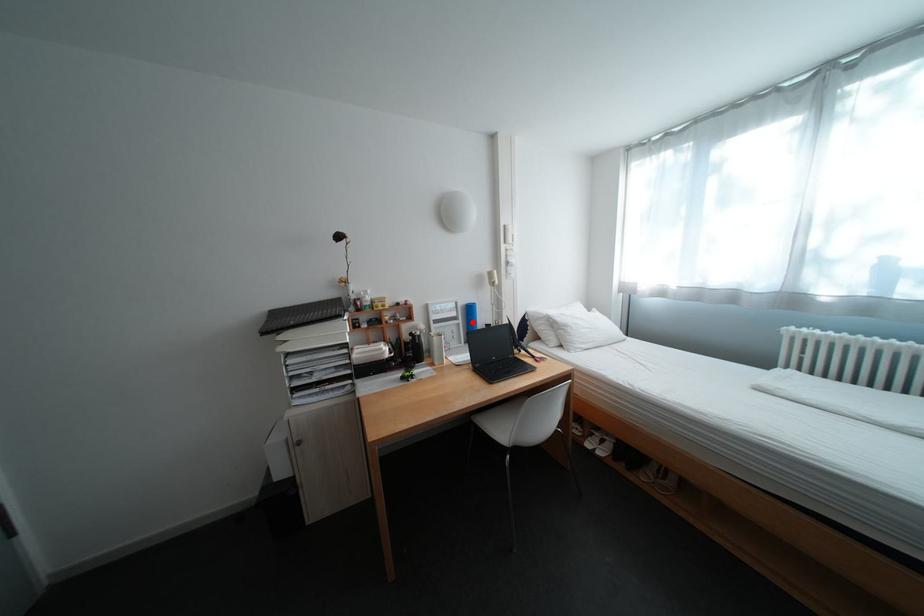
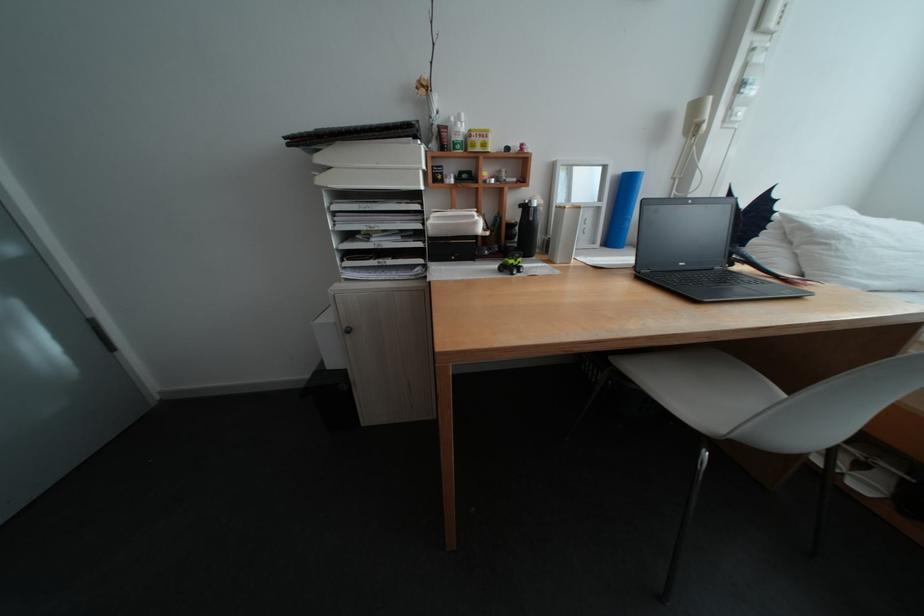
Question: A red point is marked in image1. In image2, is the corresponding 3D point closer to the camera or farther? Reply with the corresponding letter.

Choices:
 (A) The corresponding 3D point is closer.
 (B) The corresponding 3D point is farther.

Answer: (A)